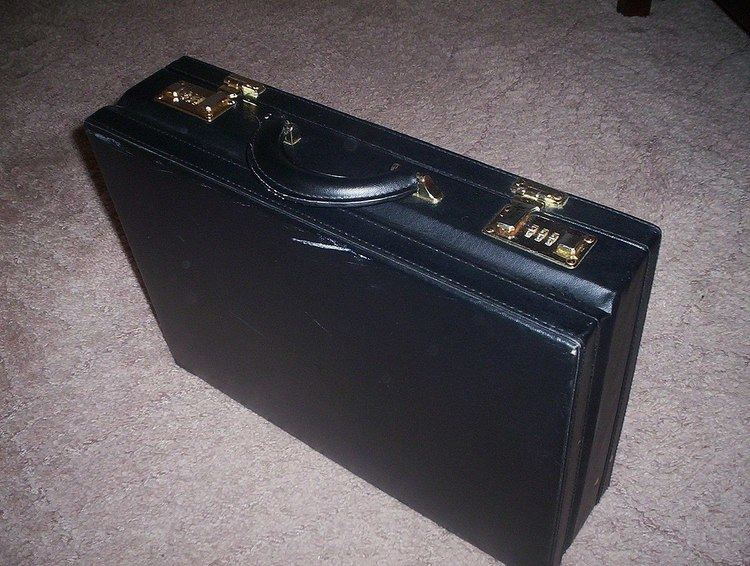
At what (x,y) coordinates should I click in order to perform the action: click on gray looking rug. Please return your answer as a coordinate pair (x, y). The width and height of the screenshot is (750, 566). Looking at the image, I should click on [x=120, y=456].